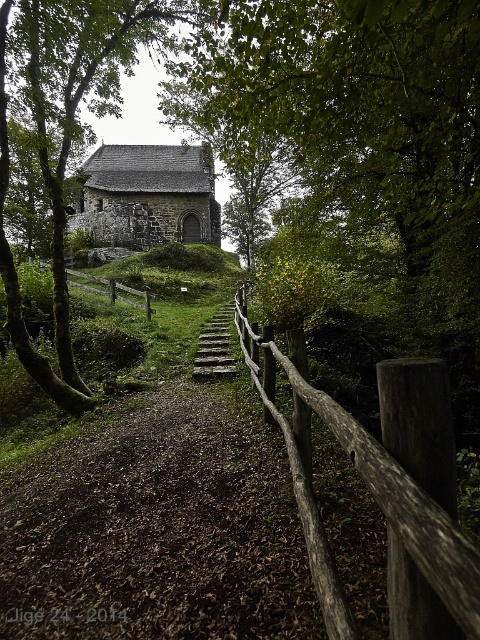
You are standing at the base of the grassy mound looking towards the stone building. There are two fences in front of you, the rustic wooden fence at center and the brown wooden fence at center. Which fence is closer to you?

The rustic wooden fence at center is closer to you because it is located below the brown wooden fence at center, indicating it is in a lower position relative to the viewer.

You are standing at the origin point of the image. Which direction should you move to reach the stone church at center?

The stone church at center is located at coordinates point (x=148, y=196), so you should move towards the center of the image to reach it.